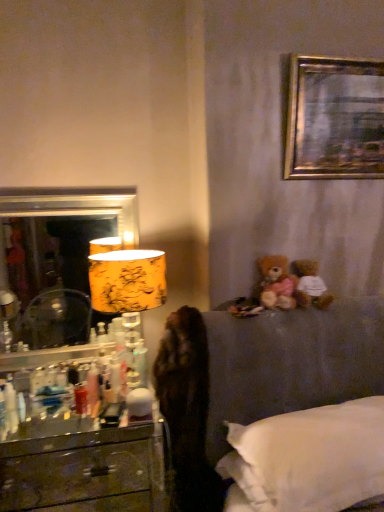
This screenshot has height=512, width=384. I want to click on white plush teddy bear at upper right, the second teddy bear positioned from the left, so click(x=310, y=285).

What is the approximate width of yellow floral fabric lampshade at left?

10.64 inches.

What do you see at coordinates (127, 280) in the screenshot? I see `yellow floral fabric lampshade at left` at bounding box center [127, 280].

What do you see at coordinates (58, 253) in the screenshot? The height and width of the screenshot is (512, 384). I see `gold leaf mirror at left` at bounding box center [58, 253].

What do you see at coordinates (277, 283) in the screenshot? I see `brown plush teddy bear at upper right, marked as the 2th teddy bear in a right-to-left arrangement` at bounding box center [277, 283].

The height and width of the screenshot is (512, 384). Describe the element at coordinates (332, 118) in the screenshot. I see `gold metallic picture frame at upper right` at that location.

Describe the element at coordinates (187, 410) in the screenshot. I see `fuzzy brown teddy bear at left` at that location.

Locate an element on the screen. white plush teddy bear at upper right, marked as the first teddy bear in a right-to-left arrangement is located at coordinates (310, 285).

From the image's perspective, is gold metallic picture frame at upper right under fuzzy brown teddy bear at left?

Actually, gold metallic picture frame at upper right appears above fuzzy brown teddy bear at left in the image.

From a real-world perspective, is gold metallic picture frame at upper right positioned under fuzzy brown teddy bear at left based on gravity?

No, from a real-world perspective, gold metallic picture frame at upper right is not below fuzzy brown teddy bear at left.

At what (x,y) coordinates should I click in order to perform the action: click on dark that is below the gold metallic picture frame at upper right (from the image's perspective). Please return your answer as a coordinate pair (x, y). Looking at the image, I should click on (187, 410).

Considering the sizes of gold metallic picture frame at upper right and fuzzy brown teddy bear at left in the image, is gold metallic picture frame at upper right wider or thinner than fuzzy brown teddy bear at left?

In the image, gold metallic picture frame at upper right appears to be more narrow than fuzzy brown teddy bear at left.

Does brown plush teddy bear at upper right, acting as the first teddy bear starting from the left, touch white soft pillow at lower right?

No.

Where is `teddy bear that is the 2nd object located above the white soft pillow at lower right (from the image's perspective)`? This screenshot has width=384, height=512. teddy bear that is the 2nd object located above the white soft pillow at lower right (from the image's perspective) is located at coordinates (277, 283).

In the image, is brown plush teddy bear at upper right, acting as the first teddy bear starting from the left, on the left side or the right side of white soft pillow at lower right?

From the image, it's evident that brown plush teddy bear at upper right, acting as the first teddy bear starting from the left, is to the left of white soft pillow at lower right.

How many degrees apart are the facing directions of brown plush teddy bear at upper right, acting as the first teddy bear starting from the left, and white soft pillow at lower right?

The angular difference between brown plush teddy bear at upper right, acting as the first teddy bear starting from the left, and white soft pillow at lower right is 0.0642 degrees.

Is brown plush teddy bear at upper right, acting as the first teddy bear starting from the left, next to white plush teddy bear at upper right, marked as the first teddy bear in a right-to-left arrangement?

Yes, brown plush teddy bear at upper right, acting as the first teddy bear starting from the left, is with white plush teddy bear at upper right, marked as the first teddy bear in a right-to-left arrangement.

Locate an element on the screen. Image resolution: width=384 pixels, height=512 pixels. teddy bear that appears behind the brown plush teddy bear at upper right, marked as the 2th teddy bear in a right-to-left arrangement is located at coordinates (310, 285).

From the image's perspective, which object appears higher, brown plush teddy bear at upper right, marked as the 2th teddy bear in a right-to-left arrangement, or white plush teddy bear at upper right, marked as the first teddy bear in a right-to-left arrangement?

brown plush teddy bear at upper right, marked as the 2th teddy bear in a right-to-left arrangement, appears higher in the image.

Is gold metallic picture frame at upper right far away from white soft pillow at lower right?

That's right, there is a large distance between gold metallic picture frame at upper right and white soft pillow at lower right.

In terms of size, does gold metallic picture frame at upper right appear bigger or smaller than white soft pillow at lower right?

In the image, gold metallic picture frame at upper right appears to be smaller than white soft pillow at lower right.

In the scene shown: From the image's perspective, is gold metallic picture frame at upper right located above or below white soft pillow at lower right?

Clearly, from the image's perspective, gold metallic picture frame at upper right is above white soft pillow at lower right.

Visually, is gold metallic picture frame at upper right positioned to the left or to the right of white soft pillow at lower right?

In the image, gold metallic picture frame at upper right appears on the right side of white soft pillow at lower right.

Which of these two, gold metallic picture frame at upper right or brown plush teddy bear at upper right, marked as the 2th teddy bear in a right-to-left arrangement, stands shorter?

Standing shorter between the two is brown plush teddy bear at upper right, marked as the 2th teddy bear in a right-to-left arrangement.

Between gold metallic picture frame at upper right and brown plush teddy bear at upper right, marked as the 2th teddy bear in a right-to-left arrangement, which one is positioned in front?

Positioned in front is gold metallic picture frame at upper right.

From a real-world perspective, is gold metallic picture frame at upper right positioned over brown plush teddy bear at upper right, marked as the 2th teddy bear in a right-to-left arrangement, based on gravity?

Correct, in the physical world, gold metallic picture frame at upper right is higher than brown plush teddy bear at upper right, marked as the 2th teddy bear in a right-to-left arrangement.

Is gold metallic picture frame at upper right smaller than brown plush teddy bear at upper right, marked as the 2th teddy bear in a right-to-left arrangement?

Incorrect, gold metallic picture frame at upper right is not smaller in size than brown plush teddy bear at upper right, marked as the 2th teddy bear in a right-to-left arrangement.

Between fuzzy brown teddy bear at left and white soft pillow at lower right, which one has smaller width?

Thinner between the two is fuzzy brown teddy bear at left.

From the image's perspective, is fuzzy brown teddy bear at left positioned above or below white soft pillow at lower right?

Clearly, from the image's perspective, fuzzy brown teddy bear at left is below white soft pillow at lower right.

Is white soft pillow at lower right at the back of fuzzy brown teddy bear at left?

No, fuzzy brown teddy bear at left is not facing away from white soft pillow at lower right.

Consider the image. Measure the distance from fuzzy brown teddy bear at left to white soft pillow at lower right.

fuzzy brown teddy bear at left is 12.29 inches away from white soft pillow at lower right.

Is wooden drawer at lower left located within brown plush teddy bear at upper right, acting as the first teddy bear starting from the left?

No.

Who is taller, brown plush teddy bear at upper right, marked as the 2th teddy bear in a right-to-left arrangement, or wooden drawer at lower left?

With more height is brown plush teddy bear at upper right, marked as the 2th teddy bear in a right-to-left arrangement.

Which point is more forward, (272, 267) or (102, 479)?

The point (272, 267) is closer to the camera.

Find the location of a particular element. the 2nd teddy bear above when counting from the wooden drawer at lower left (from the image's perspective) is located at coordinates pyautogui.click(x=277, y=283).

Find the location of a particular element. This screenshot has width=384, height=512. dark on the left of the gold metallic picture frame at upper right is located at coordinates (187, 410).

From the white soft pillow at lower right, count 1st teddy bears backward and point to it. Please provide its 2D coordinates.

[(277, 283)]

Considering their positions, is white soft pillow at lower right positioned further to gold metallic picture frame at upper right than white plush teddy bear at upper right, the second teddy bear positioned from the left?

Based on the image, white soft pillow at lower right appears to be further to gold metallic picture frame at upper right.

When comparing their distances from white soft pillow at lower right, does brown plush teddy bear at upper right, marked as the 2th teddy bear in a right-to-left arrangement, or yellow floral fabric lampshade at left seem further?

yellow floral fabric lampshade at left.

Estimate the real-world distances between objects in this image. Which object is further from brown plush teddy bear at upper right, acting as the first teddy bear starting from the left, gold leaf mirror at left or fuzzy brown teddy bear at left?

The object further to brown plush teddy bear at upper right, acting as the first teddy bear starting from the left, is gold leaf mirror at left.

Consider the image. Considering their positions, is brown plush teddy bear at upper right, acting as the first teddy bear starting from the left, positioned further to white plush teddy bear at upper right, marked as the first teddy bear in a right-to-left arrangement, than fuzzy brown teddy bear at left?

Among the two, fuzzy brown teddy bear at left is located further to white plush teddy bear at upper right, marked as the first teddy bear in a right-to-left arrangement.

When comparing their distances from white plush teddy bear at upper right, the second teddy bear positioned from the left, does wooden drawer at lower left or white soft pillow at lower right seem further?

A: The object further to white plush teddy bear at upper right, the second teddy bear positioned from the left, is wooden drawer at lower left.

Based on their spatial positions, is white plush teddy bear at upper right, marked as the first teddy bear in a right-to-left arrangement, or yellow floral fabric lampshade at left closer to gold leaf mirror at left?

yellow floral fabric lampshade at left is closer to gold leaf mirror at left.

Estimate the real-world distances between objects in this image. Which object is closer to fuzzy brown teddy bear at left, brown plush teddy bear at upper right, marked as the 2th teddy bear in a right-to-left arrangement, or white plush teddy bear at upper right, marked as the first teddy bear in a right-to-left arrangement?

brown plush teddy bear at upper right, marked as the 2th teddy bear in a right-to-left arrangement, lies closer to fuzzy brown teddy bear at left than the other object.

Based on the photo, when comparing their distances from white plush teddy bear at upper right, marked as the first teddy bear in a right-to-left arrangement, does white soft pillow at lower right or gold leaf mirror at left seem closer?

white soft pillow at lower right.

Identify the location of mirror between gold metallic picture frame at upper right and wooden drawer at lower left in the vertical direction. coord(58,253).

Find the location of a particular element. teddy bear between white soft pillow at lower right and white plush teddy bear at upper right, the second teddy bear positioned from the left, along the z-axis is located at coordinates (277, 283).

At what (x,y) coordinates should I click in order to perform the action: click on teddy bear between gold leaf mirror at left and white plush teddy bear at upper right, marked as the first teddy bear in a right-to-left arrangement. Please return your answer as a coordinate pair (x, y). The width and height of the screenshot is (384, 512). Looking at the image, I should click on click(x=277, y=283).

Locate an element on the screen. Image resolution: width=384 pixels, height=512 pixels. dark situated between gold leaf mirror at left and brown plush teddy bear at upper right, acting as the first teddy bear starting from the left, from left to right is located at coordinates click(187, 410).